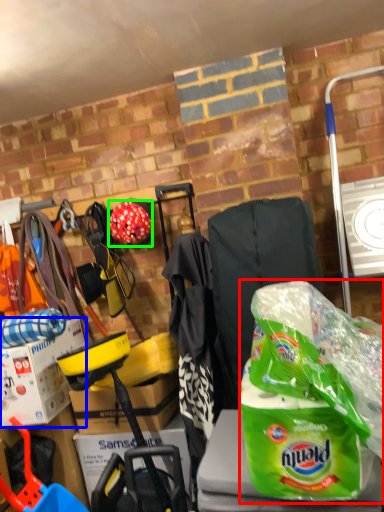
Question: Which object is the closest to the plastic bag (highlighted by a red box)? Choose among these: box (highlighted by a blue box) or helmet (highlighted by a green box).

Choices:
 (A) box
 (B) helmet

Answer: (B)